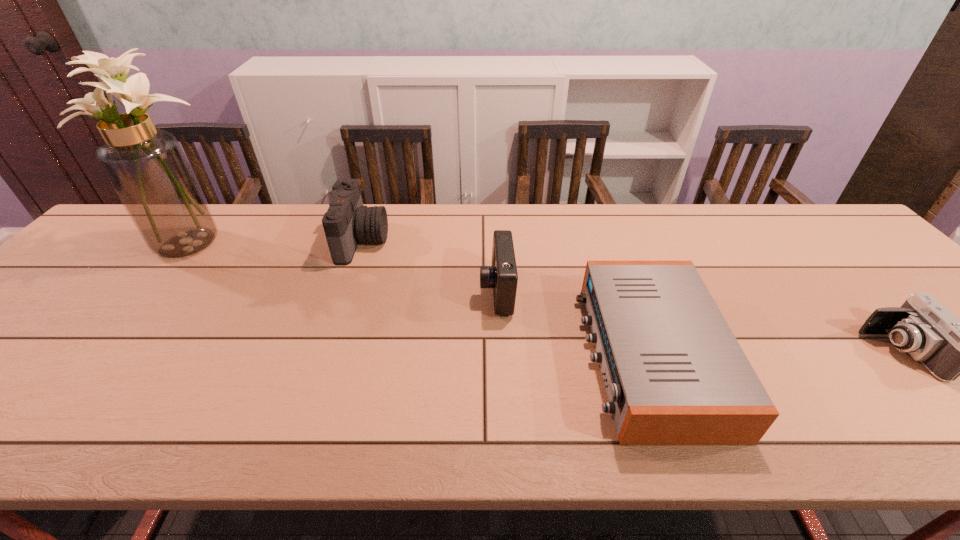
Identify the location of free area in between the radio receiver and the third object from left to right. (573, 323).

You are a GUI agent. You are given a task and a screenshot of the screen. Output one action in this format:
    pyautogui.click(x=<x>, y=<y>)
    Task: Click on the vacant area that lies between the rightmost object and the second object from right to left
    The width and height of the screenshot is (960, 540).
    Given the screenshot: What is the action you would take?
    pyautogui.click(x=774, y=354)

At what (x,y) coordinates should I click in order to perform the action: click on free spot between the third object from right to left and the second object from left to right. Please return your answer as a coordinate pair (x, y). The width and height of the screenshot is (960, 540). Looking at the image, I should click on (429, 266).

The image size is (960, 540). Identify the location of free space between the radio receiver and the shortest camera. (774, 354).

In order to click on vacant area that lies between the radio receiver and the shortest camera in this screenshot , I will do `click(774, 354)`.

I want to click on unoccupied position between the second object from right to left and the rightmost object, so [774, 354].

Image resolution: width=960 pixels, height=540 pixels. What are the coordinates of `vacant region between the second camera from right to left and the tallest object` in the screenshot? It's located at (347, 266).

Where is `object that is the third closest one to the flower arrangement`? The width and height of the screenshot is (960, 540). object that is the third closest one to the flower arrangement is located at coordinates (675, 374).

Choose which object is the third nearest neighbor to the leftmost object. Please provide its 2D coordinates. Your answer should be formatted as a tuple, i.e. [(x, y)], where the tuple contains the x and y coordinates of a point satisfying the conditions above.

[(675, 374)]

Identify which camera is the second nearest to the nearest camera. Please provide its 2D coordinates. Your answer should be formatted as a tuple, i.e. [(x, y)], where the tuple contains the x and y coordinates of a point satisfying the conditions above.

[(347, 221)]